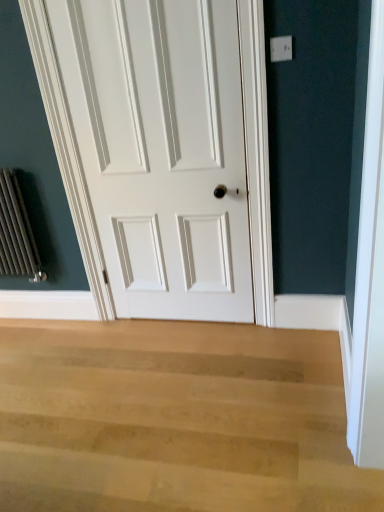
Question: Considering the relative positions of light wood floor at lower center and white painted wood door at center in the image provided, is light wood floor at lower center to the left or to the right of white painted wood door at center?

Choices:
 (A) right
 (B) left

Answer: (B)

Question: From a real-world perspective, relative to white painted wood door at center, is light wood floor at lower center vertically above or below?

Choices:
 (A) below
 (B) above

Answer: (A)

Question: From the image's perspective, is light wood floor at lower center above or below white painted wood door at center?

Choices:
 (A) below
 (B) above

Answer: (A)

Question: Considering the positions of white painted wood door at center and light wood floor at lower center in the image, is white painted wood door at center wider or thinner than light wood floor at lower center?

Choices:
 (A) wide
 (B) thin

Answer: (B)

Question: From the image's perspective, is white painted wood door at center above or below light wood floor at lower center?

Choices:
 (A) above
 (B) below

Answer: (A)

Question: From a real-world perspective, is white painted wood door at center above or below light wood floor at lower center?

Choices:
 (A) below
 (B) above

Answer: (B)

Question: Is white painted wood door at center in front of or behind light wood floor at lower center in the image?

Choices:
 (A) front
 (B) behind

Answer: (B)